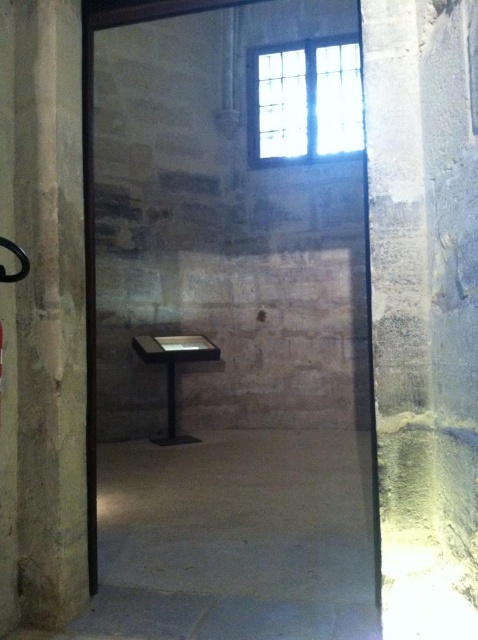
Is smooth stone pillar at left taller than clear glass window at upper center?

Yes, smooth stone pillar at left is taller than clear glass window at upper center.

The height and width of the screenshot is (640, 478). What are the coordinates of `smooth stone pillar at left` in the screenshot? It's located at (43, 316).

Is point (39, 273) positioned behind point (184, 337)?

No.

Can you confirm if smooth stone pillar at left is smaller than matte black table at center?

Yes.

Where is `smooth stone pillar at left`? This screenshot has height=640, width=478. smooth stone pillar at left is located at coordinates (43, 316).

At what (x,y) coordinates should I click in order to perform the action: click on smooth stone pillar at left. Please return your answer as a coordinate pair (x, y). This screenshot has height=640, width=478. Looking at the image, I should click on (43, 316).

Does clear glass window at upper center have a lesser height compared to matte black table at center?

No.

The image size is (478, 640). What do you see at coordinates (304, 100) in the screenshot? I see `clear glass window at upper center` at bounding box center [304, 100].

This screenshot has width=478, height=640. I want to click on clear glass window at upper center, so click(x=304, y=100).